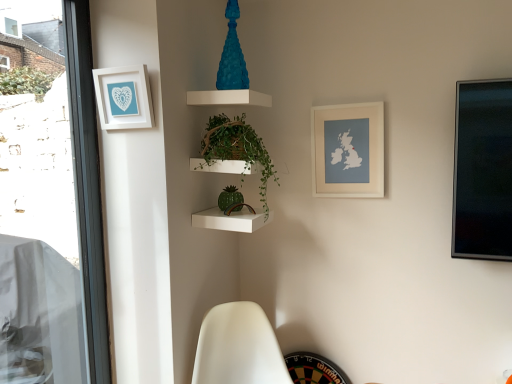
Question: Choose the correct answer: Is white matte picture frame at upper left, the 1th picture frame viewed from the left, inside white matte map at upper right, which is the 2th picture frame in front-to-back order, or outside it?

Choices:
 (A) outside
 (B) inside

Answer: (A)

Question: Looking at their shapes, would you say white matte picture frame at upper left, the 1th picture frame viewed from the left, is wider or thinner than white matte map at upper right, which is the 2th picture frame in front-to-back order?

Choices:
 (A) thin
 (B) wide

Answer: (B)

Question: Estimate the real-world distances between objects in this image. Which object is farther from the white matte map at upper right, which is the 2th picture frame in front-to-back order?

Choices:
 (A) white matte picture frame at upper left, the 1th picture frame viewed from the left
 (B) transparent glass window at left
 (C) white matte swivel chair at lower center
 (D) green glossy plant at center

Answer: (B)

Question: Which object is the closest to the transparent glass window at left?

Choices:
 (A) green glossy plant at center
 (B) white matte map at upper right, placed as the first picture frame when sorted from right to left
 (C) white matte picture frame at upper left, the 2th picture frame from the back
 (D) white matte swivel chair at lower center

Answer: (C)